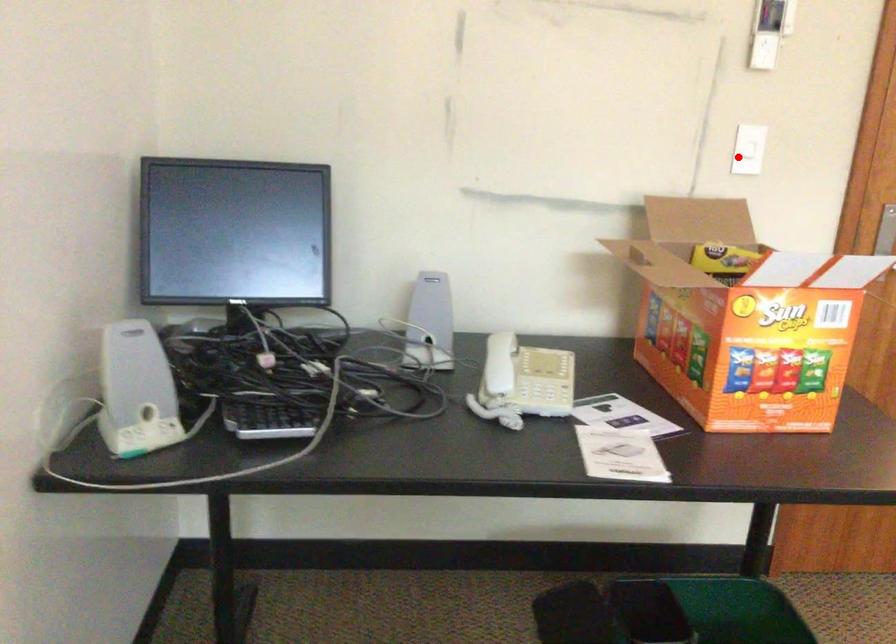
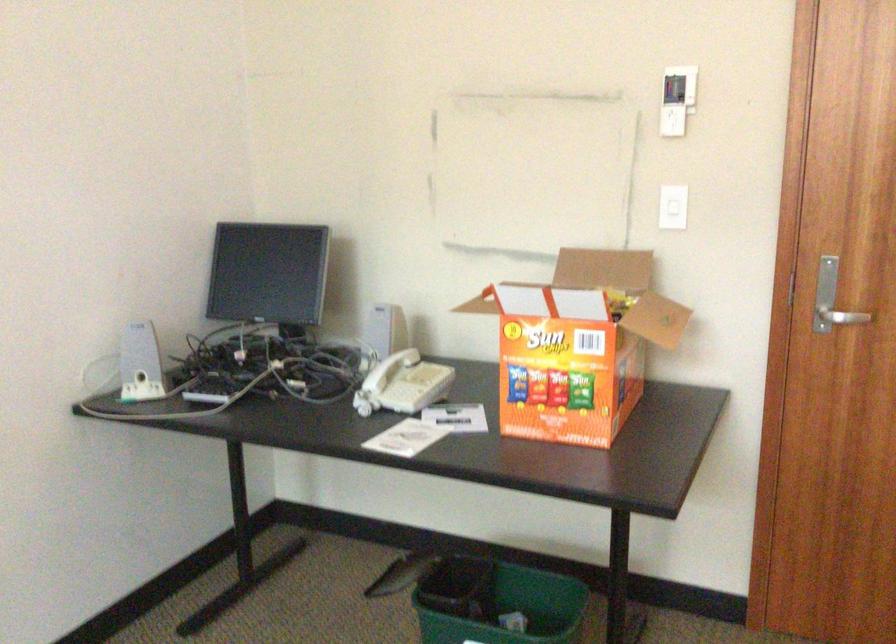
Question: I am providing you with two images of the same scene from different viewpoints. Given a red point in image1, look at the same physical point in image2. Is it:

Choices:
 (A) Closer to the viewpoint
 (B) Farther from the viewpoint

Answer: (B)